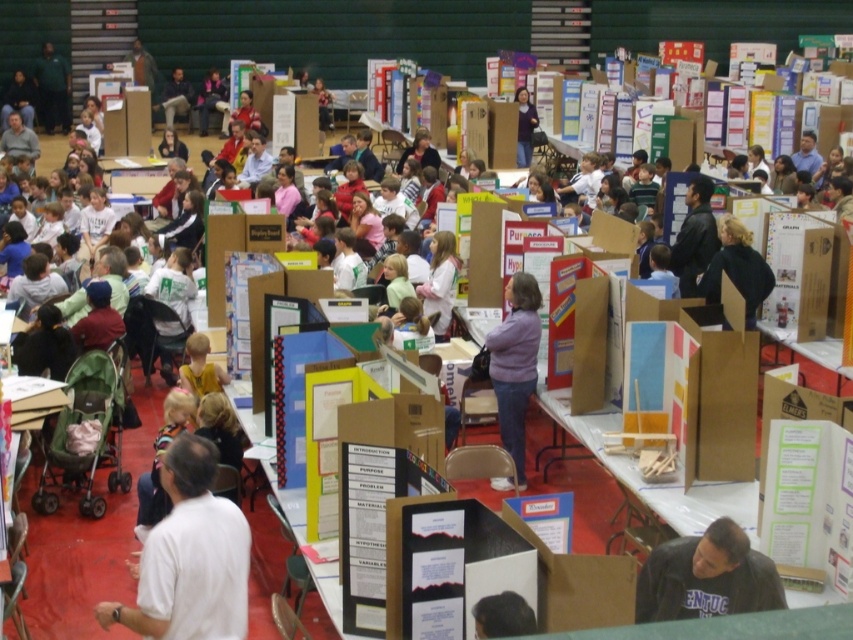
Between dark gray sweatshirt at lower right and matte purple shirt at center, which one is positioned lower?

dark gray sweatshirt at lower right

Can you confirm if dark gray sweatshirt at lower right is taller than matte purple shirt at center?

Incorrect, dark gray sweatshirt at lower right's height is not larger of matte purple shirt at center's.

Describe the element at coordinates (706, 577) in the screenshot. The image size is (853, 640). I see `dark gray sweatshirt at lower right` at that location.

Where is `dark gray sweatshirt at lower right`? The height and width of the screenshot is (640, 853). dark gray sweatshirt at lower right is located at coordinates (706, 577).

In the scene shown: Who is positioned more to the right, white shirt at lower left or matte purple shirt at center?

From the viewer's perspective, matte purple shirt at center appears more on the right side.

Which is more to the left, white shirt at lower left or matte purple shirt at center?

white shirt at lower left

The width and height of the screenshot is (853, 640). Describe the element at coordinates (189, 556) in the screenshot. I see `white shirt at lower left` at that location.

Find the location of `white shirt at lower left`. white shirt at lower left is located at coordinates (189, 556).

Can you confirm if purple fabric shirt at center is shorter than blonde hair at center?

No, purple fabric shirt at center is not shorter than blonde hair at center.

Is purple fabric shirt at center wider than blonde hair at center?

No.

This screenshot has width=853, height=640. Describe the element at coordinates (515, 364) in the screenshot. I see `purple fabric shirt at center` at that location.

Where is `purple fabric shirt at center`? The width and height of the screenshot is (853, 640). purple fabric shirt at center is located at coordinates (515, 364).